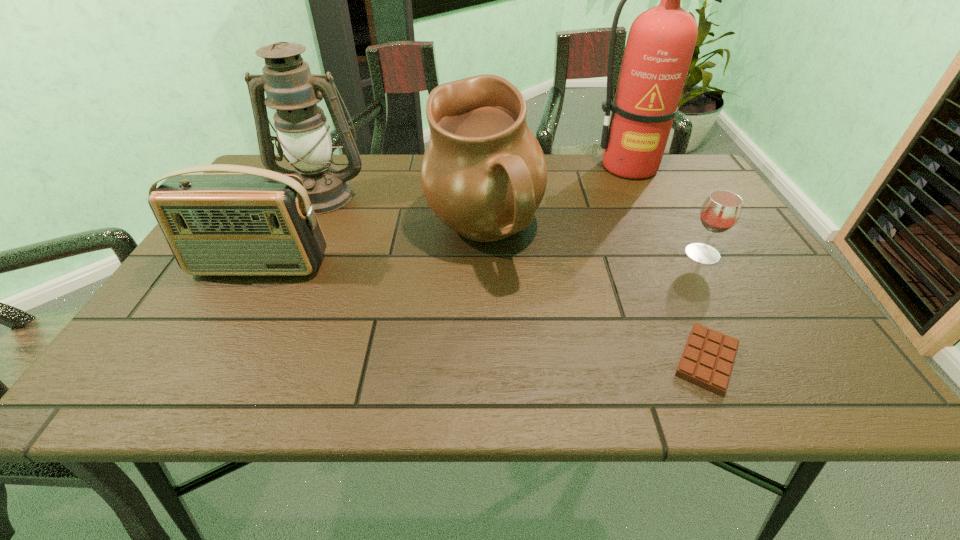
This screenshot has width=960, height=540. I want to click on the tallest object, so click(x=661, y=41).

Locate an element on the screen. This screenshot has height=540, width=960. oil lamp is located at coordinates (303, 135).

At what (x,y) coordinates should I click in order to perform the action: click on the third object from left to right. Please return your answer as a coordinate pair (x, y). Looking at the image, I should click on (484, 174).

Locate an element on the screen. The width and height of the screenshot is (960, 540). cream pitcher is located at coordinates (484, 174).

Identify the location of radio receiver. (252, 222).

I want to click on the fifth tallest object, so click(x=721, y=210).

At what (x,y) coordinates should I click in order to perform the action: click on the shortest object. Please return your answer as a coordinate pair (x, y). Looking at the image, I should click on (707, 360).

The height and width of the screenshot is (540, 960). In order to click on candy bar in this screenshot , I will do `click(707, 360)`.

You are a GUI agent. You are given a task and a screenshot of the screen. Output one action in this format:
    pyautogui.click(x=<x>, y=<y>)
    Task: Click on the free space located on the side of the fire extinguisher with the nozzle and handle
    The image size is (960, 540).
    Given the screenshot: What is the action you would take?
    pyautogui.click(x=644, y=199)

What are the coordinates of `vacant space located 0.390m on the front of the oil lamp` in the screenshot? It's located at (258, 329).